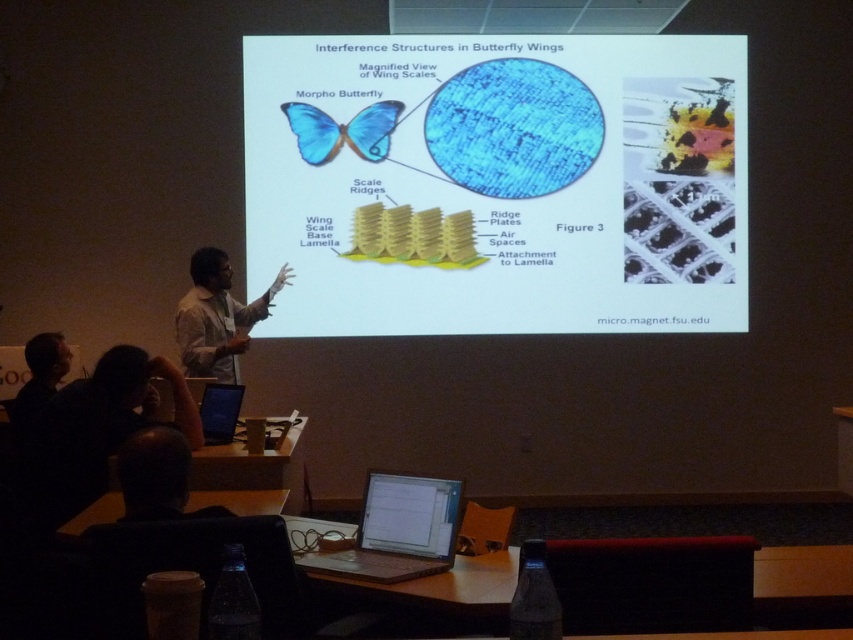
You are organizing a science fair exhibit and need to place both the matte blue morpho butterfly at center and the blue matte laptop at lower left on a shelf. Given their sizes, which object should you place first to ensure stability?

The matte blue morpho butterfly at center is much taller than the blue matte laptop at lower left, so you should place the taller matte blue morpho butterfly at center first to ensure stability.

You are sitting in the back row of the lecture hall and want to take a photo of the presenter wearing the white shirt at center and the white glossy screen at center. Which one will appear wider in your photo?

The white shirt at center will appear wider in the photo because its width surpasses that of the white glossy screen at center.

You are an attendee sitting in the front row of the lecture hall. You notice two points marked on the screen during the presentation. The first point is at coordinate point (x=321, y=145) and the second is at point (x=223, y=412). Which of these points appears closer to you?

Point (x=321, y=145) is further to the viewer than point (x=223, y=412), so the second point at (x=223, y=412) appears closer to you.